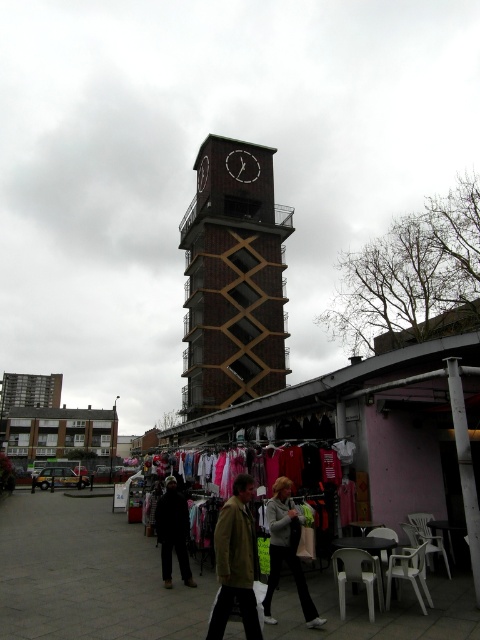
Question: Which object is the closest to the dark fabric jacket at center?

Choices:
 (A) green textured jacket at center
 (B) brown brick clock tower at center

Answer: (A)

Question: Does green textured jacket at center have a larger size compared to gray fleece jacket at center?

Choices:
 (A) no
 (B) yes

Answer: (A)

Question: Which object is closer to the camera taking this photo?

Choices:
 (A) white wooden clock at center
 (B) green textured jacket at center
 (C) brown brick clock tower at center
 (D) gray fleece jacket at center

Answer: (B)

Question: Is brown brick clock tower at center wider than white wooden clock at center?

Choices:
 (A) no
 (B) yes

Answer: (B)

Question: Considering the real-world distances, which object is farthest from the white wooden clock at center?

Choices:
 (A) brown brick clock tower at center
 (B) dark fabric jacket at center

Answer: (B)

Question: Is black matte clock at upper center positioned behind white wooden clock at center?

Choices:
 (A) yes
 (B) no

Answer: (A)